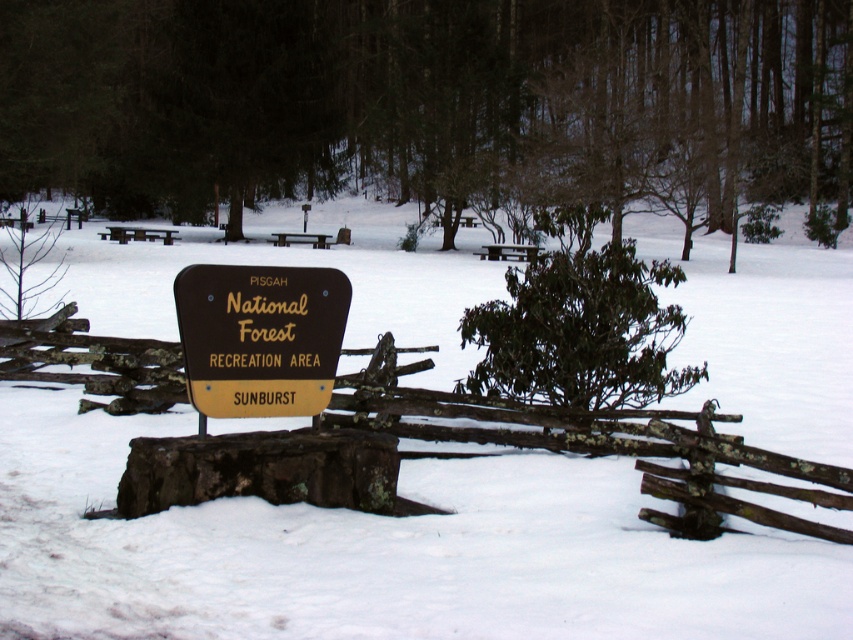
Can you confirm if brown wooden fence at center is bigger than green leafy bush at center?

No.

Between brown wooden fence at center and green leafy bush at center, which one appears on the right side from the viewer's perspective?

Positioned to the right is green leafy bush at center.

This screenshot has width=853, height=640. In order to click on brown wooden fence at center in this screenshot , I will do `click(596, 444)`.

Consider the image. Does green leafy bush at center appear under wooden picnic table at upper left?

Indeed, green leafy bush at center is positioned under wooden picnic table at upper left.

Locate an element on the screen. The height and width of the screenshot is (640, 853). green leafy bush at center is located at coordinates (579, 324).

Where is `green leafy bush at center`? green leafy bush at center is located at coordinates (579, 324).

Who is shorter, green leafy bush at center or brown wood sign at center?

Standing shorter between the two is brown wood sign at center.

Does green leafy bush at center have a smaller size compared to brown wood sign at center?

Incorrect, green leafy bush at center is not smaller in size than brown wood sign at center.

At what (x,y) coordinates should I click in order to perform the action: click on green leafy bush at center. Please return your answer as a coordinate pair (x, y). This screenshot has height=640, width=853. Looking at the image, I should click on (579, 324).